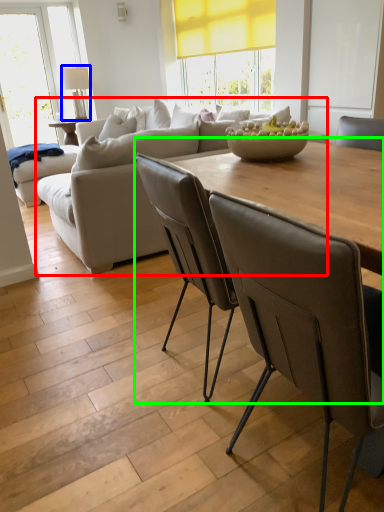
Question: Considering the real-world distances, which object is farthest from studio couch (highlighted by a red box)? lamp (highlighted by a blue box) or table (highlighted by a green box)?

Choices:
 (A) lamp
 (B) table

Answer: (A)